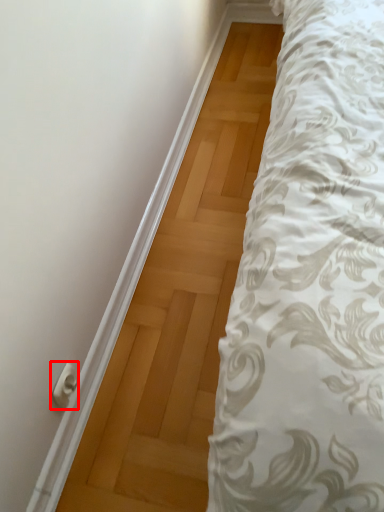
Question: From the image's perspective, considering the relative positions of door handle (annotated by the red box) and door in the image provided, where is door handle (annotated by the red box) located with respect to the staircase?

Choices:
 (A) below
 (B) above

Answer: (A)